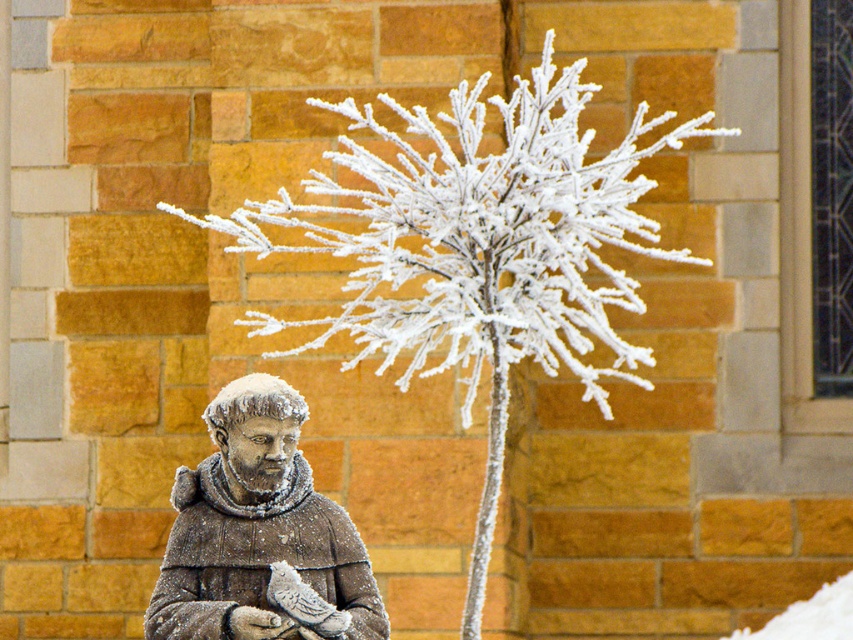
Question: Is frosted white branches at center wider than frosted stone statue at lower left?

Choices:
 (A) yes
 (B) no

Answer: (A)

Question: Which point is closer to the camera?

Choices:
 (A) frosted white branches at center
 (B) frosted stone statue at lower left

Answer: (B)

Question: Considering the relative positions of frosted white branches at center and frosted stone statue at lower left in the image provided, where is frosted white branches at center located with respect to frosted stone statue at lower left?

Choices:
 (A) below
 (B) above

Answer: (B)

Question: Which point is closer to the camera?

Choices:
 (A) (445, 237)
 (B) (254, 477)

Answer: (B)

Question: Can you confirm if frosted white branches at center is thinner than frosted stone statue at lower left?

Choices:
 (A) yes
 (B) no

Answer: (B)

Question: Which point appears closest to the camera in this image?

Choices:
 (A) (637, 173)
 (B) (219, 637)

Answer: (B)